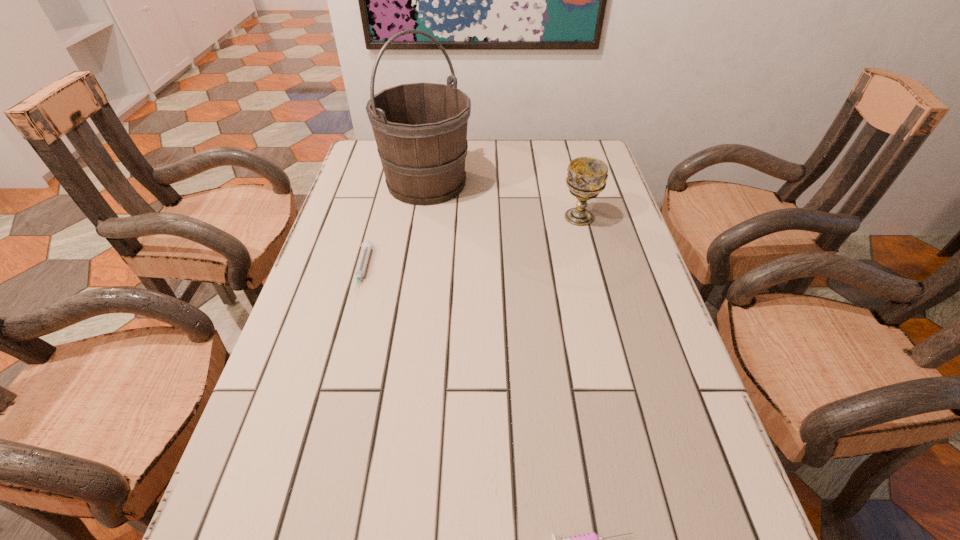
Locate an element on the screen. The height and width of the screenshot is (540, 960). the tallest object is located at coordinates (420, 129).

Identify the location of the second tallest object. (586, 178).

Where is `the left syringe`? Image resolution: width=960 pixels, height=540 pixels. the left syringe is located at coordinates [x=367, y=245].

At what (x,y) coordinates should I click in order to perform the action: click on the farther syringe. Please return your answer as a coordinate pair (x, y). Looking at the image, I should click on click(x=367, y=245).

Find the location of a particular element. vacant point located 0.110m on the front of the tallest object is located at coordinates (419, 235).

Image resolution: width=960 pixels, height=540 pixels. What are the coordinates of `vacant area situated on the front of the chalice` in the screenshot? It's located at (588, 254).

At what (x,y) coordinates should I click in order to perform the action: click on free space located 0.110m at the needle end of the farther syringe. Please return your answer as a coordinate pair (x, y). The height and width of the screenshot is (540, 960). Looking at the image, I should click on (346, 336).

Locate an element on the screen. Image resolution: width=960 pixels, height=540 pixels. object that is positioned at the far edge is located at coordinates (420, 129).

Image resolution: width=960 pixels, height=540 pixels. Identify the location of bucket located in the left edge section of the desktop. (420, 129).

You are a GUI agent. You are given a task and a screenshot of the screen. Output one action in this format:
    pyautogui.click(x=<x>, y=<y>)
    Task: Click on the syringe situated at the left edge
    The image size is (960, 540).
    Given the screenshot: What is the action you would take?
    pyautogui.click(x=367, y=245)